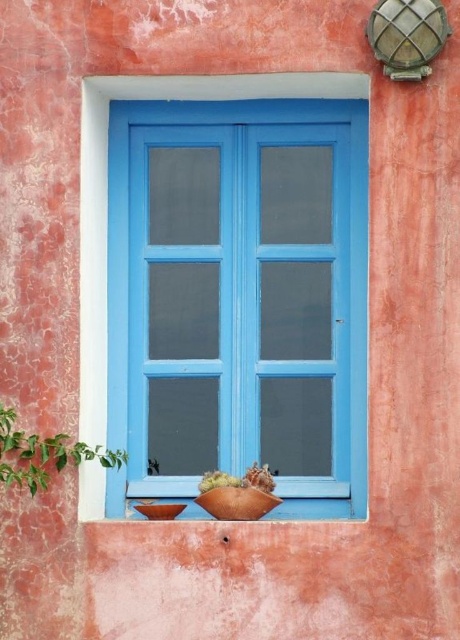
Question: Considering the real-world distances, which object is closest to the green leafy plant at lower left?

Choices:
 (A) rustic terracotta pot at center
 (B) matte brown pot at lower center
 (C) blue painted wood window at center

Answer: (C)

Question: Does blue painted wood window at center have a lesser width compared to rustic terracotta pot at center?

Choices:
 (A) yes
 (B) no

Answer: (B)

Question: Which object appears farthest from the camera in this image?

Choices:
 (A) blue painted wood window at center
 (B) green leafy plant at lower left
 (C) matte brown pot at lower center
 (D) rustic terracotta pot at center

Answer: (C)

Question: Is blue painted wood window at center further to camera compared to green leafy plant at lower left?

Choices:
 (A) no
 (B) yes

Answer: (B)

Question: Which of these objects is positioned farthest from the green leafy plant at lower left?

Choices:
 (A) rustic terracotta pot at center
 (B) blue painted wood window at center
 (C) matte brown pot at lower center

Answer: (C)

Question: Is blue painted wood window at center positioned in front of rustic terracotta pot at center?

Choices:
 (A) yes
 (B) no

Answer: (A)